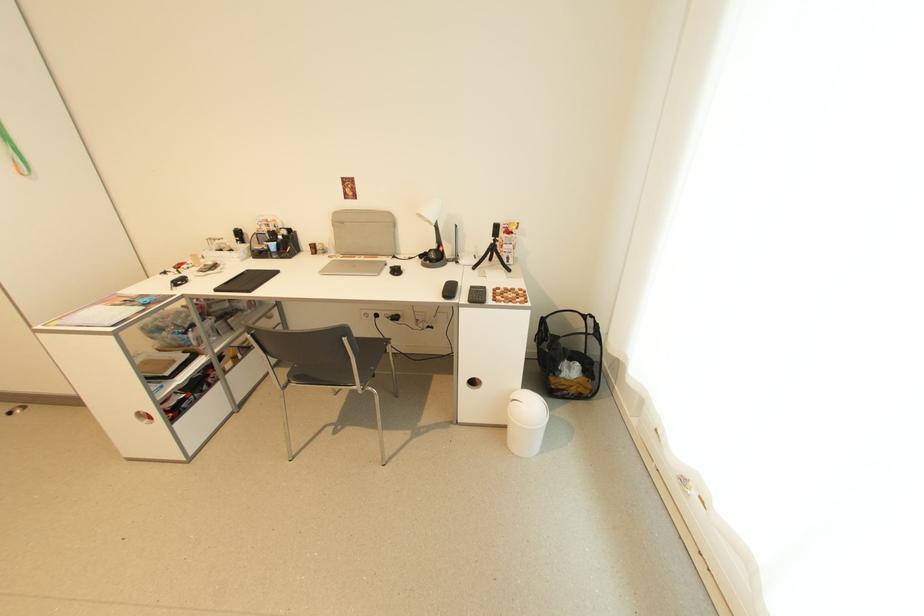
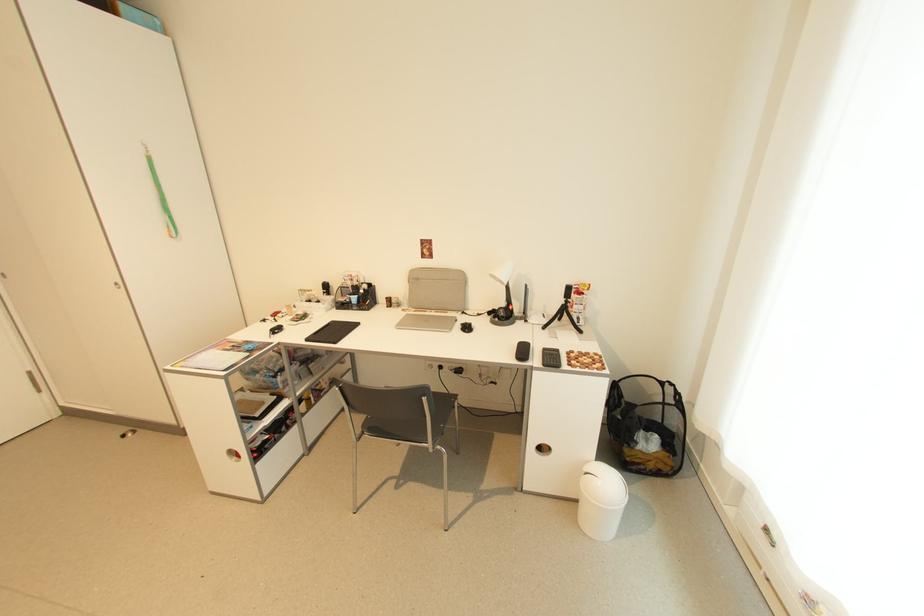
Where in the second image is the point corresponding to point (148, 422) from the first image?

(237, 460)